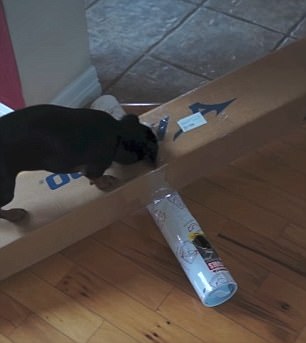
This screenshot has width=306, height=343. Find the location of `border between two floorings`. border between two floorings is located at coordinates (x=139, y=105).